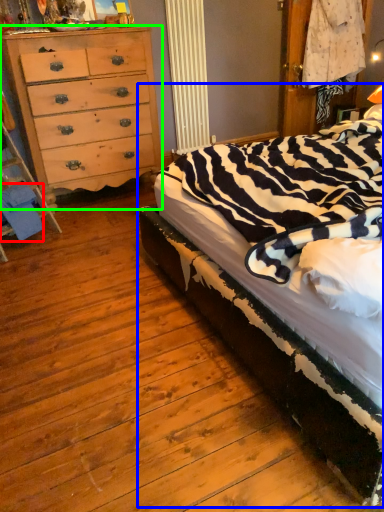
Question: Which is nearer to the material (highlighted by a red box)? bed (highlighted by a blue box) or chest of drawers (highlighted by a green box).

Choices:
 (A) bed
 (B) chest of drawers

Answer: (B)